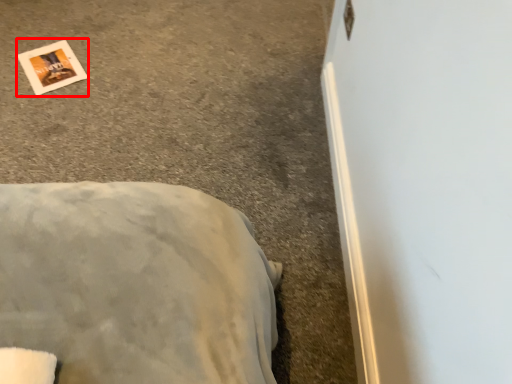
Question: From the image's perspective, where is postcard (annotated by the red box) located relative to concrete?

Choices:
 (A) above
 (B) below

Answer: (A)